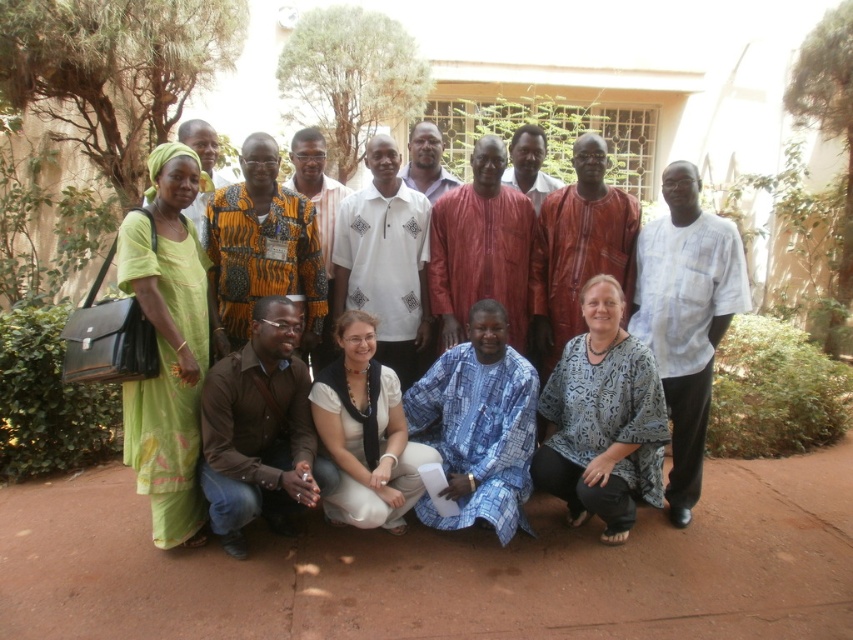
You are standing at the position of the matte red shirt at center. A friend is standing 4.30 meters away from you. Which direction should you walk to reach them?

The friend is 4.30 meters away from the matte red shirt at center, but the direction isn not specified in the scene description. Without additional information about their relative positions, it is impossible to determine the direction to walk.

You are a photographer standing at the edge of the scene. You need to adjust the focus so that both the white cotton blouse at center and the blue patterned shirt at center are in clear view. Given that your camera can focus on objects within a 5 feet range, can you achieve this without moving closer?

The white cotton blouse at center is 6.40 feet away from the blue patterned shirt at center. Since the distance between them exceeds the camera focus range of 5 feet, adjusting focus to include both might not be possible without moving closer.

From the picture: Based on the coordinates provided, which object is located at point (364, 433)?

The white cotton blouse at center is located at point (364, 433).